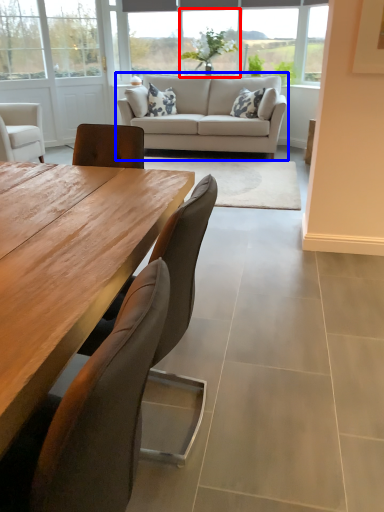
Question: Which of the following is the closest to the observer, window (highlighted by a red box) or studio couch (highlighted by a blue box)?

Choices:
 (A) window
 (B) studio couch

Answer: (B)